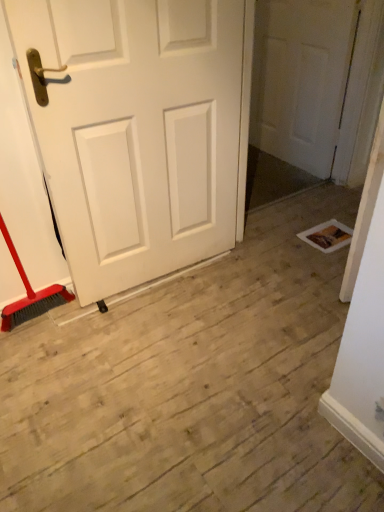
Question: Considering the positions of white matte door at left, arranged as the first door when viewed from the front, and white matte door at upper right, the 1th door viewed from the right, in the image, is white matte door at left, arranged as the first door when viewed from the front, bigger or smaller than white matte door at upper right, the 1th door viewed from the right,?

Choices:
 (A) small
 (B) big

Answer: (B)

Question: Relative to white matte door at upper right, the first door in the back-to-front sequence, is white matte door at left, which appears as the 1th door when viewed from the left, in front or behind?

Choices:
 (A) front
 (B) behind

Answer: (A)

Question: Is white matte door at left, marked as the second door in a back-to-front arrangement, inside or outside of white matte door at upper right, the first door in the back-to-front sequence?

Choices:
 (A) outside
 (B) inside

Answer: (A)

Question: Is point (294, 104) positioned closer to the camera than point (96, 56)?

Choices:
 (A) farther
 (B) closer

Answer: (A)

Question: Visually, is white matte door at upper right, the 2th door positioned from the front, positioned to the left or to the right of white matte door at left, which is counted as the 2th door, starting from the right?

Choices:
 (A) left
 (B) right

Answer: (B)

Question: From their relative heights in the image, would you say white matte door at upper right, the first door in the back-to-front sequence, is taller or shorter than white matte door at left, which appears as the 1th door when viewed from the left?

Choices:
 (A) short
 (B) tall

Answer: (A)

Question: In terms of size, does white matte door at upper right, the first door in the back-to-front sequence, appear bigger or smaller than white matte door at left, which is counted as the 2th door, starting from the right?

Choices:
 (A) small
 (B) big

Answer: (A)